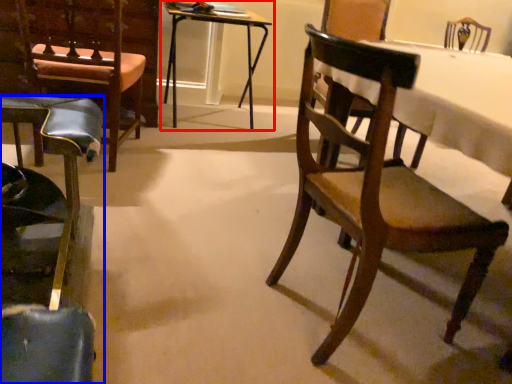
Question: Which of the following is the closest to the observer, table (highlighted by a red box) or chair (highlighted by a blue box)?

Choices:
 (A) table
 (B) chair

Answer: (B)